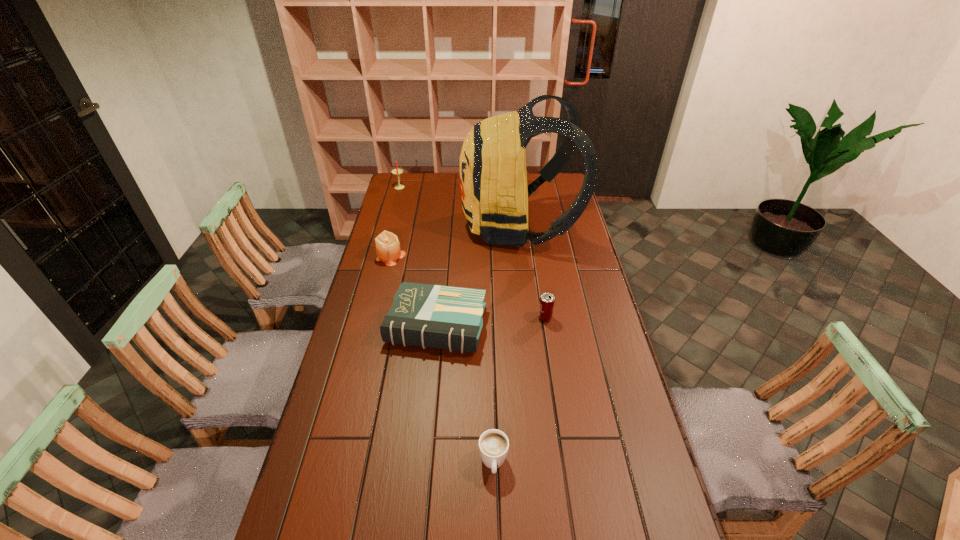
Identify the location of vacant space at the right edge of the desktop. This screenshot has height=540, width=960. (614, 463).

At what (x,y) coordinates should I click in order to perform the action: click on vacant region at the far left corner of the desktop. Please return your answer as a coordinate pair (x, y). The image size is (960, 540). Looking at the image, I should click on (420, 187).

The image size is (960, 540). Find the location of `unoccupied area between the paperback book and the beer can`. unoccupied area between the paperback book and the beer can is located at coordinates (491, 322).

I want to click on free space that is in between the farthest object and the paperback book, so click(x=418, y=256).

This screenshot has height=540, width=960. What are the coordinates of `free space between the paperback book and the backpack` in the screenshot? It's located at (478, 276).

Image resolution: width=960 pixels, height=540 pixels. I want to click on vacant region between the nearer candle and the backpack, so click(x=455, y=241).

Identify the location of free space between the beer can and the farther candle. The width and height of the screenshot is (960, 540). (472, 252).

This screenshot has width=960, height=540. Find the location of `the fifth closest object to the farthest object`. the fifth closest object to the farthest object is located at coordinates (493, 444).

Locate an element on the screen. Image resolution: width=960 pixels, height=540 pixels. the fifth closest object to the tallest object is located at coordinates (493, 444).

Identify the location of vacant area that satisfies the following two spatial constraints: 1. on the front-facing side of the tallest object; 2. on the front side of the nearer candle. (522, 256).